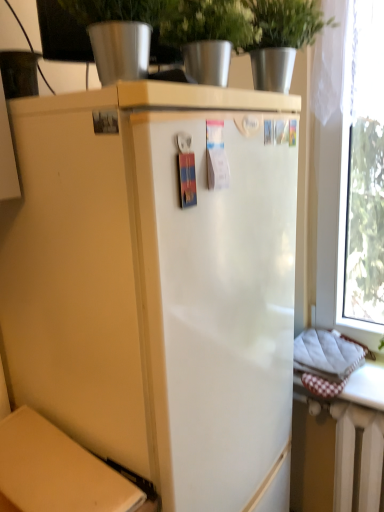
Question: From a real-world perspective, is metallic silver pot at upper center positioned under transparent glass window at right based on gravity?

Choices:
 (A) no
 (B) yes

Answer: (A)

Question: Considering the relative sizes of metallic silver pot at upper center and transparent glass window at right in the image provided, is metallic silver pot at upper center shorter than transparent glass window at right?

Choices:
 (A) yes
 (B) no

Answer: (A)

Question: Is metallic silver pot at upper center smaller than transparent glass window at right?

Choices:
 (A) no
 (B) yes

Answer: (B)

Question: From the image's perspective, is metallic silver pot at upper center below transparent glass window at right?

Choices:
 (A) yes
 (B) no

Answer: (B)

Question: Is metallic silver pot at upper center outside of transparent glass window at right?

Choices:
 (A) yes
 (B) no

Answer: (A)

Question: Looking at their shapes, would you say matte cardboard box at lower left is wider or thinner than white painted metal radiator at lower right?

Choices:
 (A) thin
 (B) wide

Answer: (B)

Question: From a real-world perspective, relative to white painted metal radiator at lower right, is matte cardboard box at lower left vertically above or below?

Choices:
 (A) below
 (B) above

Answer: (B)

Question: Is matte cardboard box at lower left to the left or to the right of white painted metal radiator at lower right in the image?

Choices:
 (A) left
 (B) right

Answer: (A)

Question: From the image's perspective, is matte cardboard box at lower left positioned above or below white painted metal radiator at lower right?

Choices:
 (A) below
 (B) above

Answer: (B)

Question: Considering the positions of metallic silver pot at upper center and matte cardboard box at lower left in the image, is metallic silver pot at upper center bigger or smaller than matte cardboard box at lower left?

Choices:
 (A) big
 (B) small

Answer: (A)

Question: Looking at their shapes, would you say metallic silver pot at upper center is wider or thinner than matte cardboard box at lower left?

Choices:
 (A) wide
 (B) thin

Answer: (B)

Question: Is metallic silver pot at upper center in front of or behind matte cardboard box at lower left in the image?

Choices:
 (A) front
 (B) behind

Answer: (B)

Question: Do you think metallic silver pot at upper center is within matte cardboard box at lower left, or outside of it?

Choices:
 (A) inside
 (B) outside

Answer: (B)

Question: Considering their positions, is transparent glass window at right located in front of or behind matte cardboard box at lower left?

Choices:
 (A) behind
 (B) front

Answer: (A)

Question: Is transparent glass window at right inside or outside of matte cardboard box at lower left?

Choices:
 (A) outside
 (B) inside

Answer: (A)